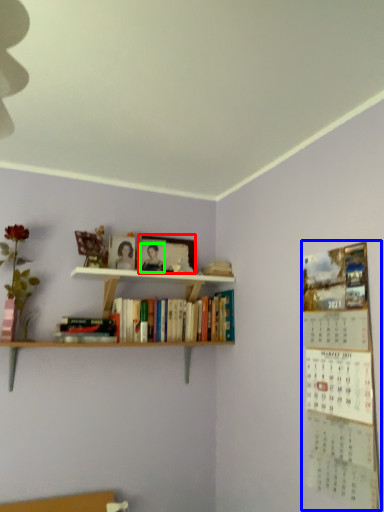
Question: Which object is positioned closest to picture frame (highlighted by a red box)? Select from bulletin board (highlighted by a blue box) and person (highlighted by a green box).

Choices:
 (A) bulletin board
 (B) person

Answer: (B)